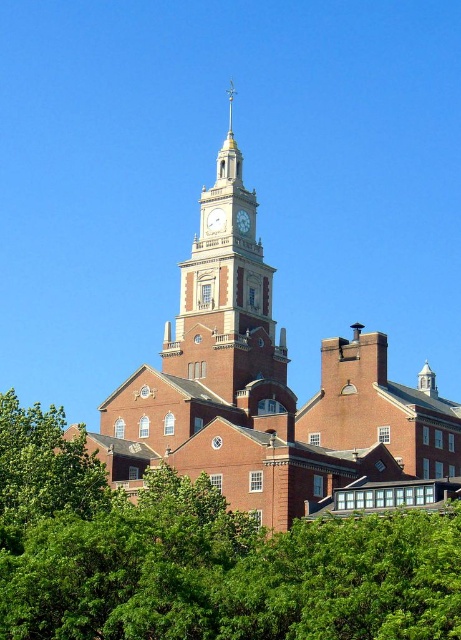
Question: Which point is closer to the camera?

Choices:
 (A) brick clock tower at center
 (B) green leafy tree at lower left

Answer: (B)

Question: Is brick church at center wider than matte gold clock at center?

Choices:
 (A) yes
 (B) no

Answer: (A)

Question: Which of the following is the farthest from the observer?

Choices:
 (A) (42, 628)
 (B) (217, 189)

Answer: (B)

Question: Can you confirm if green leafy tree at center is positioned below green leafy tree at lower left?

Choices:
 (A) no
 (B) yes

Answer: (A)

Question: Which of the following is the farthest from the observer?

Choices:
 (A) brick clock tower at center
 (B) white stone clock at center

Answer: (B)

Question: Is brick clock tower at center closer to camera compared to white stone clock at center?

Choices:
 (A) no
 (B) yes

Answer: (B)